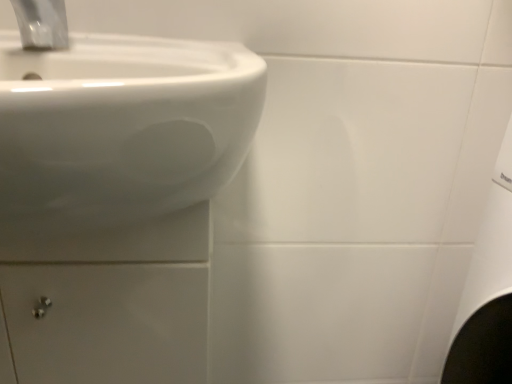
Question: Does white glossy drawer at lower left have a lesser height compared to satin chrome faucet at upper left?

Choices:
 (A) yes
 (B) no

Answer: (B)

Question: Is white glossy drawer at lower left positioned with its back to satin chrome faucet at upper left?

Choices:
 (A) yes
 (B) no

Answer: (B)

Question: Is white glossy drawer at lower left wider than satin chrome faucet at upper left?

Choices:
 (A) no
 (B) yes

Answer: (B)

Question: Is white glossy drawer at lower left facing towards satin chrome faucet at upper left?

Choices:
 (A) no
 (B) yes

Answer: (A)

Question: From a real-world perspective, is white glossy drawer at lower left positioned over satin chrome faucet at upper left based on gravity?

Choices:
 (A) yes
 (B) no

Answer: (B)

Question: Can you confirm if white glossy drawer at lower left is thinner than satin chrome faucet at upper left?

Choices:
 (A) no
 (B) yes

Answer: (A)

Question: Is satin chrome faucet at upper left smaller than white glossy drawer at lower left?

Choices:
 (A) yes
 (B) no

Answer: (A)

Question: Can you confirm if satin chrome faucet at upper left is taller than white glossy drawer at lower left?

Choices:
 (A) no
 (B) yes

Answer: (A)

Question: Is satin chrome faucet at upper left at the left side of white glossy drawer at lower left?

Choices:
 (A) yes
 (B) no

Answer: (B)

Question: Is satin chrome faucet at upper left outside of white glossy drawer at lower left?

Choices:
 (A) no
 (B) yes

Answer: (B)

Question: Is satin chrome faucet at upper left behind white glossy drawer at lower left?

Choices:
 (A) no
 (B) yes

Answer: (A)

Question: From the image's perspective, would you say satin chrome faucet at upper left is shown under white glossy drawer at lower left?

Choices:
 (A) no
 (B) yes

Answer: (A)

Question: Is white glossy drawer at lower left inside the boundaries of satin chrome faucet at upper left, or outside?

Choices:
 (A) inside
 (B) outside

Answer: (B)